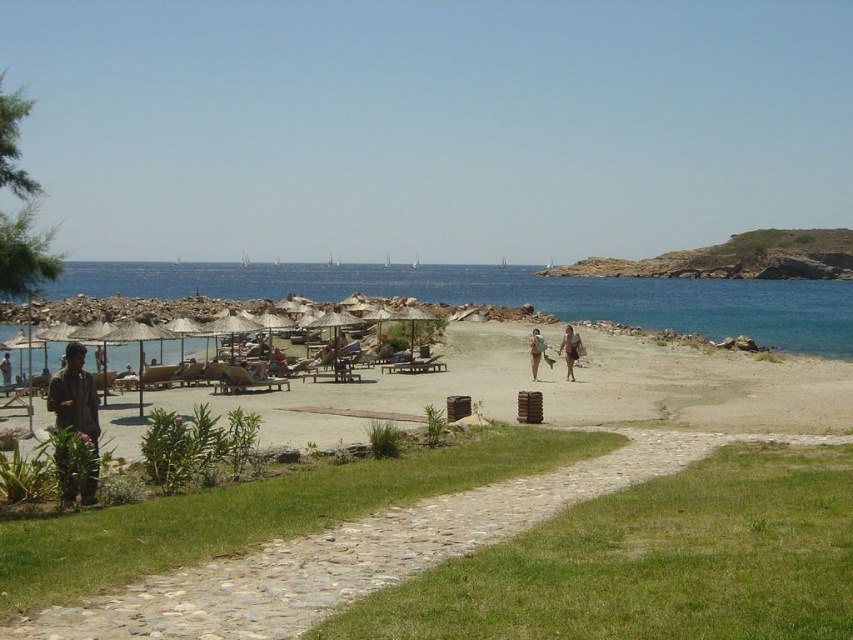
Question: Which of the following is the closest to the observer?

Choices:
 (A) brown leather jacket at lower left
 (B) green fabric shirt at lower left
 (C) tan fabric bag at center

Answer: (B)

Question: Which point is farther from the camera taking this photo?

Choices:
 (A) (572, 356)
 (B) (541, 339)

Answer: (B)

Question: Is blue water at center bigger than brown leather jacket at lower left?

Choices:
 (A) no
 (B) yes

Answer: (B)

Question: Which point is closer to the camera taking this photo?

Choices:
 (A) (64, 428)
 (B) (643, 337)
 (C) (1, 369)
 (D) (180, 268)

Answer: (A)

Question: Does green grass at lower center have a lesser width compared to brown leather jacket at lower left?

Choices:
 (A) no
 (B) yes

Answer: (A)

Question: Does blue water at center appear on the right side of green fabric shirt at lower left?

Choices:
 (A) no
 (B) yes

Answer: (B)